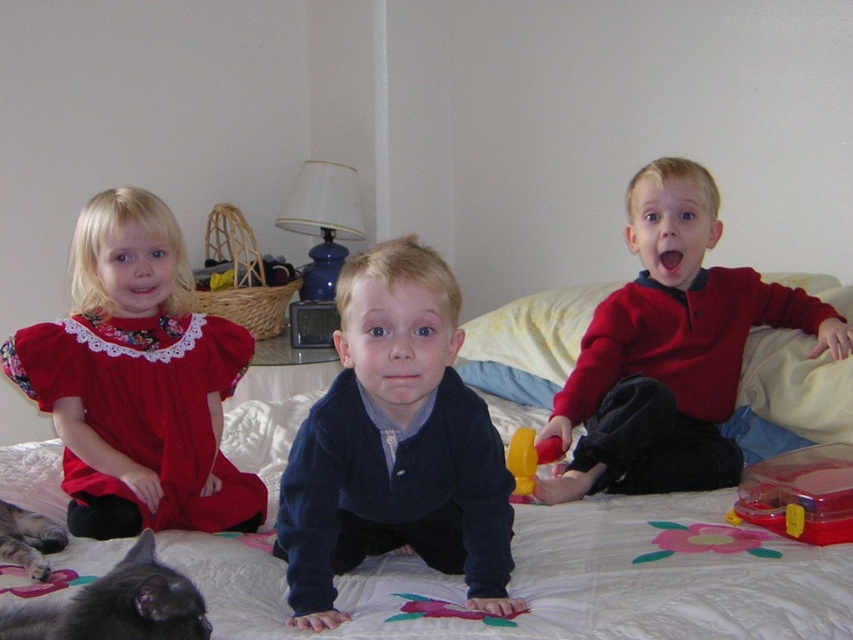
You are a photographer trying to capture a closeup of the navy blue sweater at center. You notice a point marked at coordinates (395,445). Is this point located on the navy blue sweater at center?

Yes, the point at (395,445) is located on the navy blue sweater at center as stated in the objects description.

You are a parent trying to organize toys in the room. You have a navy blue sweater at center and a translucent plastic container at lower right. Which item should you place on a shelf that requires items to be at least 15 cm in height?

The navy blue sweater at center is taller than the translucent plastic container at lower right, so the navy blue sweater at center should be placed on the shelf since it meets the height requirement.